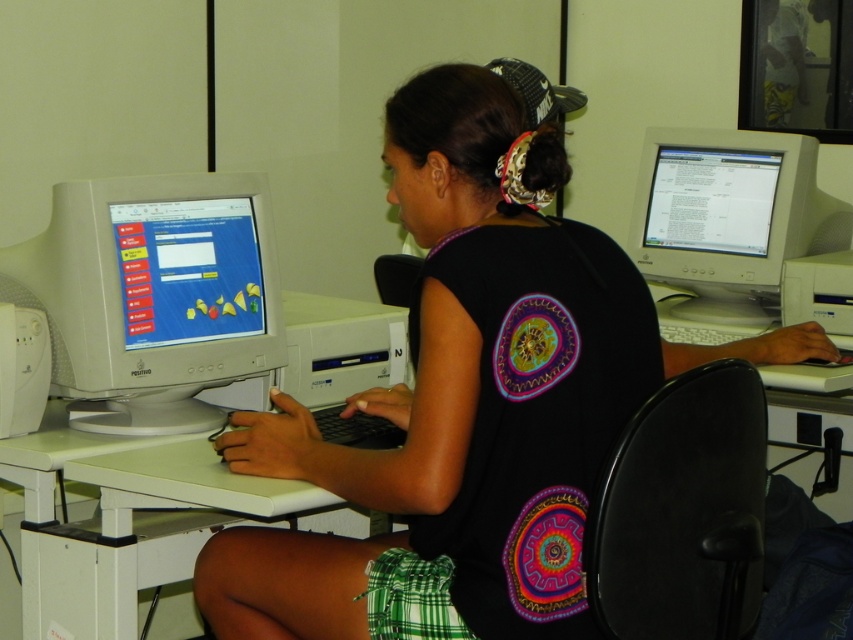
In the scene shown: You are setting up a new keyboard that is 40 cm wide. You want to place it on the white plastic computer desk at center so that it sits to the right of the white glossy computer monitor at left. Is there enough space on the desk for the keyboard?

The white glossy computer monitor at left has a lesser width compared to the white plastic computer desk at center. Since the desk is wider than the monitor, there should be enough space to place the keyboard to the right of the monitor as long as the total width of both items doesn

You are standing at the point labeled as point (59, 280) and want to move to the point labeled as point (467, 349). According to the scene, which direction should you move to reach your destination?

You should move forward because point (467, 349) is in front of point (59, 280).

You are standing at the entrance of the room and want to sit down in the black plastic chair at center. Based on the coordinates provided, in which direction should you move to reach the chair?

The black plastic chair at center is located at coordinates point (682, 512), so you should move towards the center of the room to reach it.